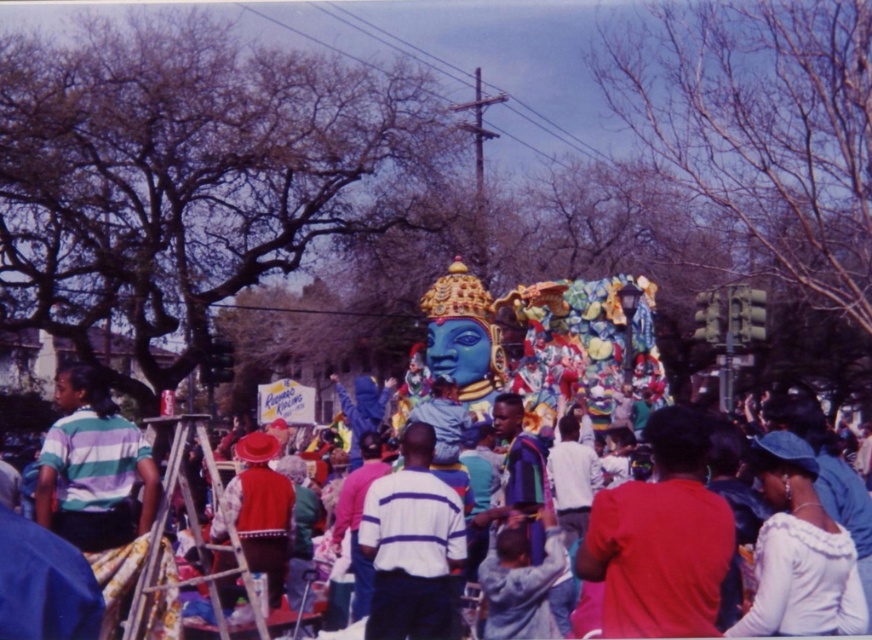
Question: In this image, where is white satin hat at upper right located relative to wooden ladder at left?

Choices:
 (A) right
 (B) left

Answer: (A)

Question: Can you confirm if wooden ladder at left is positioned to the right of shiny metallic float at center?

Choices:
 (A) yes
 (B) no

Answer: (B)

Question: Which object is the closest to the white satin hat at upper right?

Choices:
 (A) shiny metallic float at center
 (B) wooden ladder at left

Answer: (A)

Question: Considering the relative positions of white striped shirt at center and red velvet hat at center in the image provided, where is white striped shirt at center located with respect to red velvet hat at center?

Choices:
 (A) right
 (B) left

Answer: (A)

Question: Estimate the real-world distances between objects in this image. Which object is closer to the red velvet hat at center?

Choices:
 (A) white striped shirt at center
 (B) white satin hat at upper right

Answer: (A)

Question: Which point is farther to the camera?

Choices:
 (A) (862, 572)
 (B) (237, 442)
 (C) (428, 618)

Answer: (B)